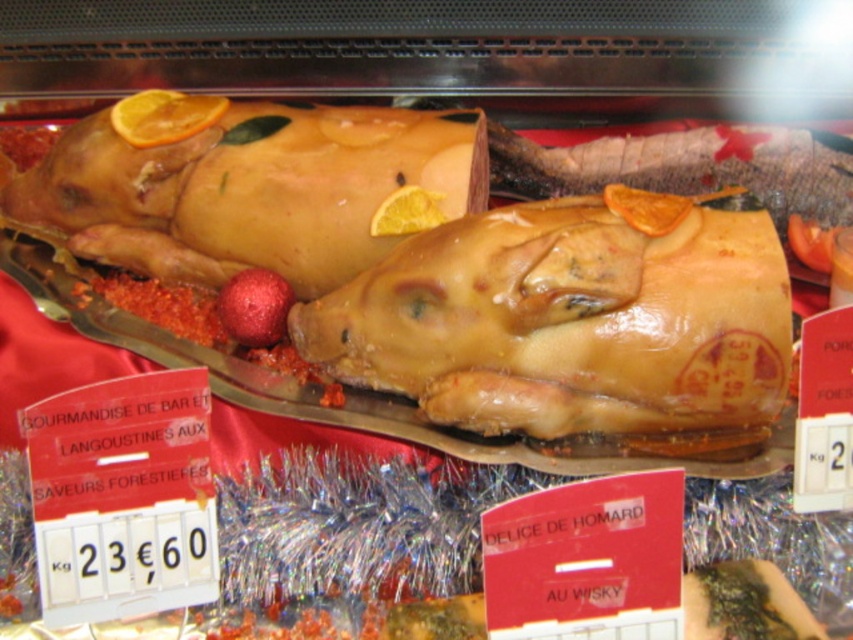
You are a customer at the market and want to locate two specific points on the roasted piglet display. The first point is at coordinate point (726, 432) and the second is at point (131, 131). From your viewing position, which point appears closer to you?

Point (726, 432) is in front of point (131, 131), so it appears closer to you.